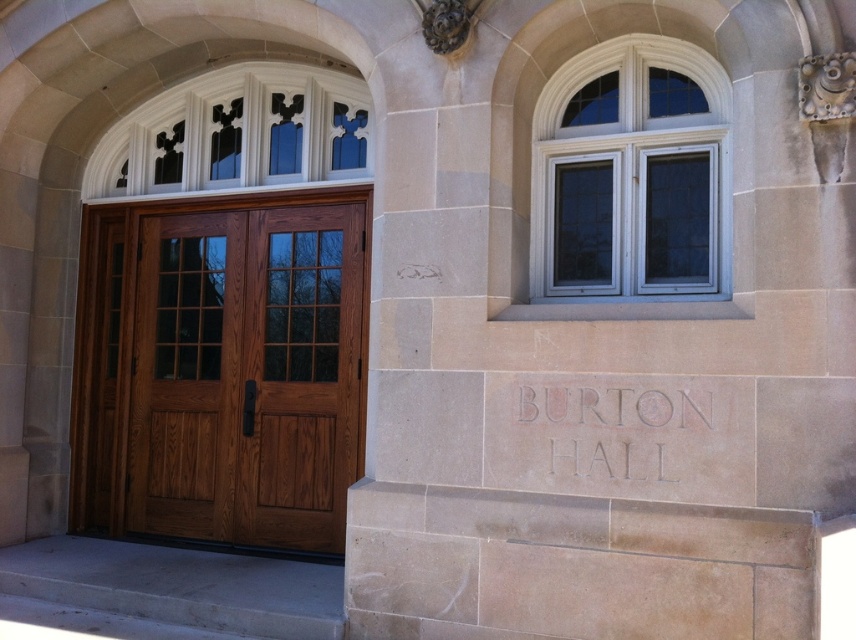
You are standing at the entrance of Burton Hall and want to read the carved stone text at center. However, there is a beige stone pillar at center blocking your view. Can you see the text clearly from your current position?

The beige stone pillar at center is positioned over the carved stone text at center, so the pillar is blocking the view of the text. You cannot see the carved stone text at center clearly from your current position.

You are standing at the entrance of Burton Hall and want to locate a specific point marked on the wall. The point is labeled as point (752, 160) in the system. Given that this point is 3.87 meters away from you, can you confirm if this point is within your immediate reach without moving closer?

The point (752, 160) is 3.87 meters away from the viewer, so it is outside of immediate reach and would require moving closer to access.